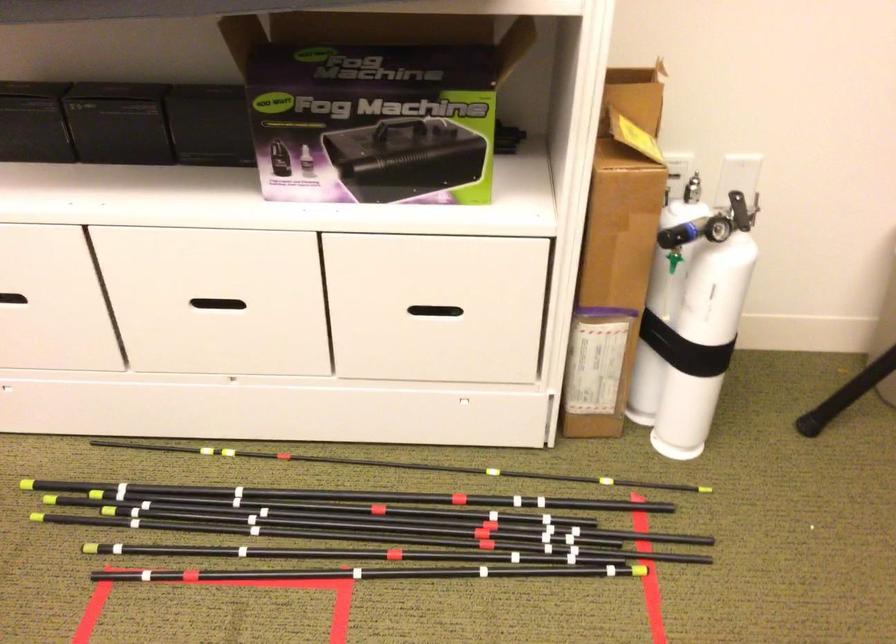
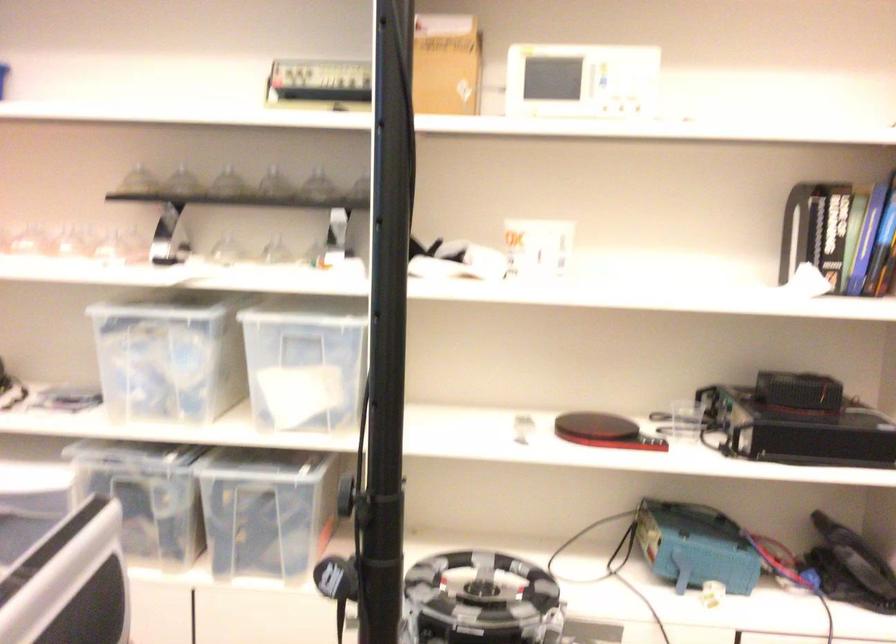
Question: What movement of the cameraman would produce the second image?

Choices:
 (A) Left
 (B) Right
 (C) Forward
 (D) Backward

Answer: (A)